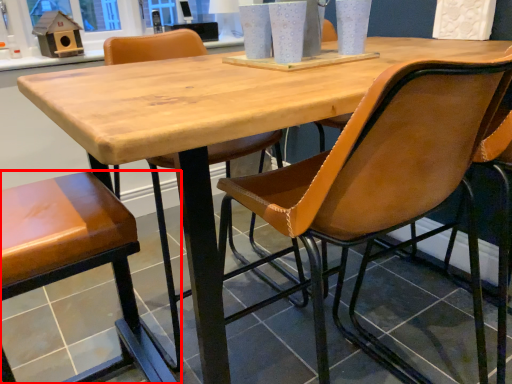
Question: From the image's perspective, what is the correct spatial relationship of chair (annotated by the red box) in relation to chair?

Choices:
 (A) above
 (B) below

Answer: (B)